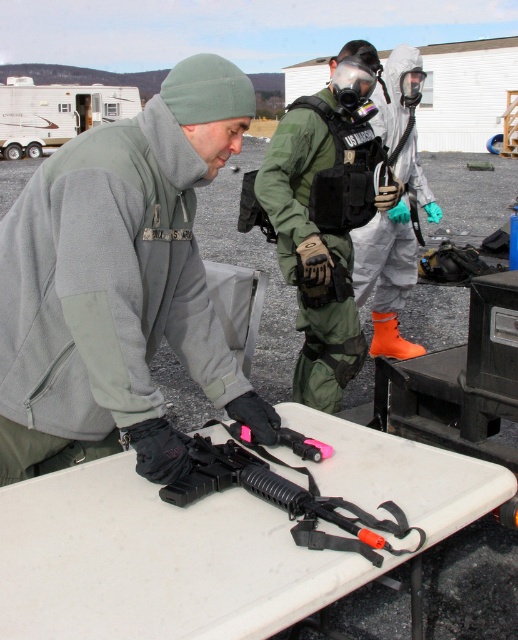
Between point (319, 173) and point (295, 544), which one is positioned in front?

Positioned in front is point (295, 544).

Between green matte uniform at center and black rubberized gun at center, which one is positioned higher?

green matte uniform at center is higher up.

In order to click on green matte uniform at center in this screenshot , I will do `click(311, 257)`.

Which is below, gray fleece jacket at center or black rubberized gun at center?

Positioned lower is black rubberized gun at center.

Between gray fleece jacket at center and black rubberized gun at center, which one has less height?

black rubberized gun at center

Identify the location of gray fleece jacket at center. The height and width of the screenshot is (640, 518). (119, 284).

Who is lower down, gray fleece jacket at center or orange rubber boots at center?

gray fleece jacket at center

Can you confirm if gray fleece jacket at center is positioned above orange rubber boots at center?

No, gray fleece jacket at center is not above orange rubber boots at center.

I want to click on gray fleece jacket at center, so click(x=119, y=284).